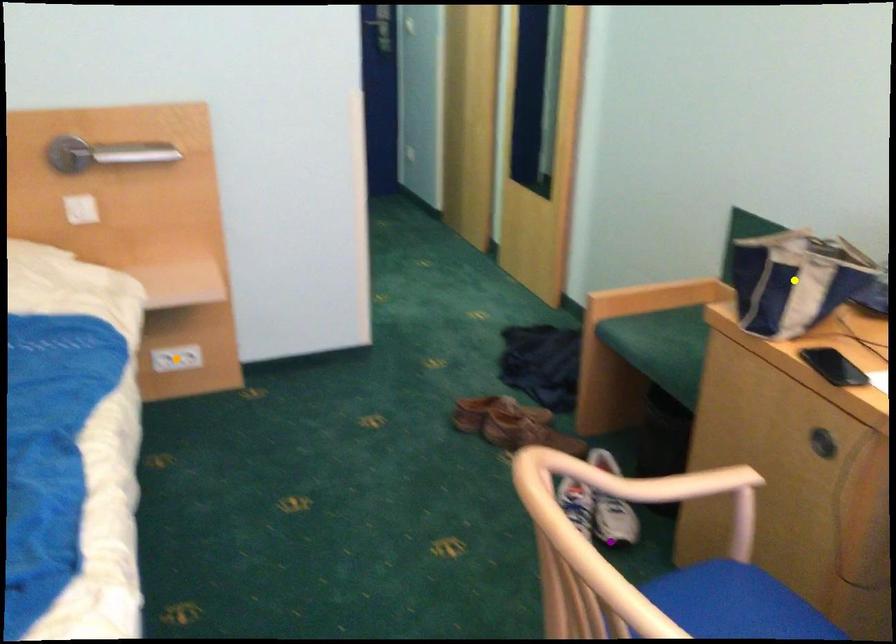
In the scene shown: Order these from nearest to farthest:
A) yellow point
B) purple point
C) orange point

purple point < yellow point < orange point